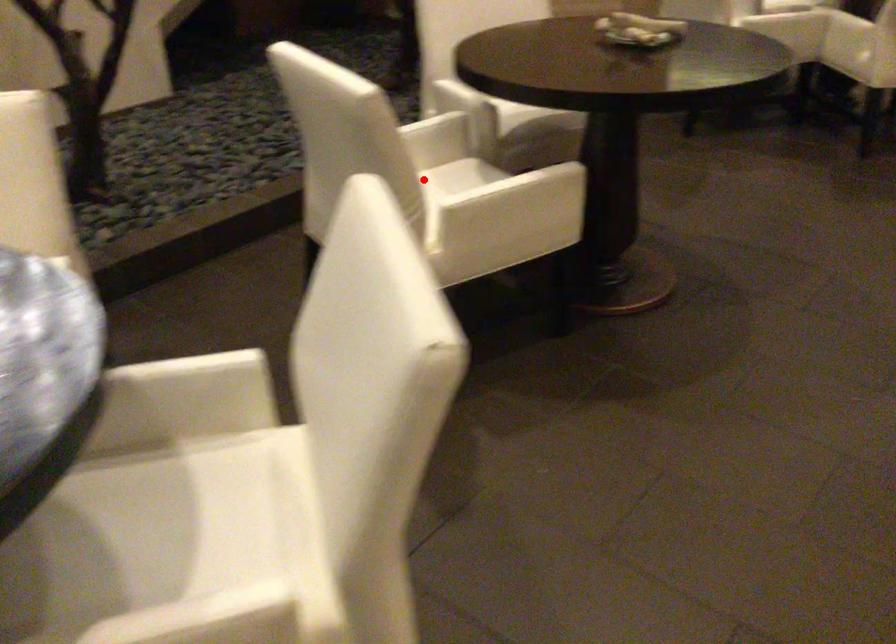
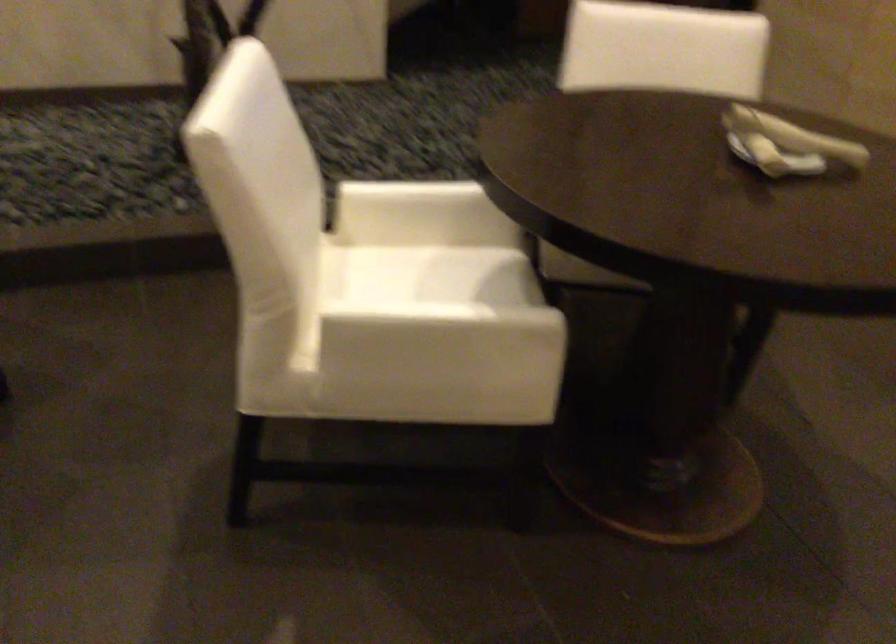
Where in the second image is the point corresponding to the highlighted location from the first image?

(412, 261)